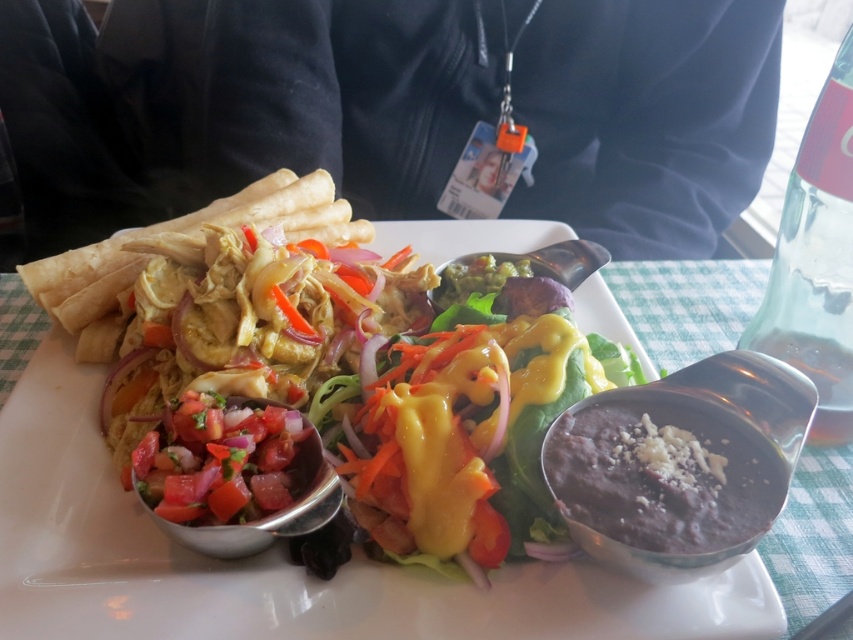
Question: Which point is farther from the camera taking this photo?

Choices:
 (A) (283, 406)
 (B) (376, 342)

Answer: (B)

Question: Is fresh green salad at center wider than sliced tomato salad at center?

Choices:
 (A) no
 (B) yes

Answer: (B)

Question: Is the position of fresh green salad at center less distant than that of sliced tomato salad at center?

Choices:
 (A) yes
 (B) no

Answer: (B)

Question: Which object is closer to the camera taking this photo?

Choices:
 (A) sliced tomato salad at center
 (B) fresh green salad at center

Answer: (A)

Question: Can you confirm if fresh green salad at center is positioned to the right of sliced tomato salad at center?

Choices:
 (A) no
 (B) yes

Answer: (B)

Question: Which point is farther to the camera?

Choices:
 (A) fresh green salad at center
 (B) sliced tomato salad at center

Answer: (A)